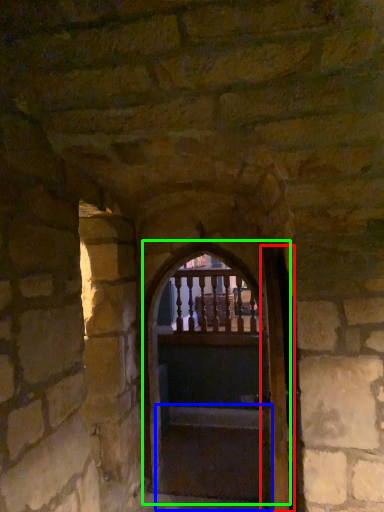
Question: Considering the real-world distances, which object is farthest from door (highlighted by a red box)? stairs (highlighted by a blue box) or door (highlighted by a green box)?

Choices:
 (A) stairs
 (B) door

Answer: (B)